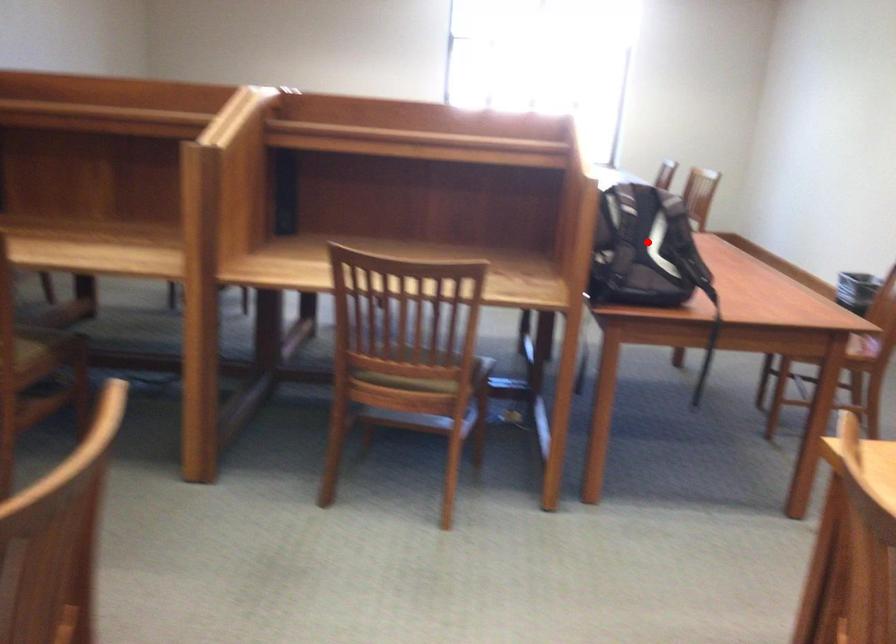
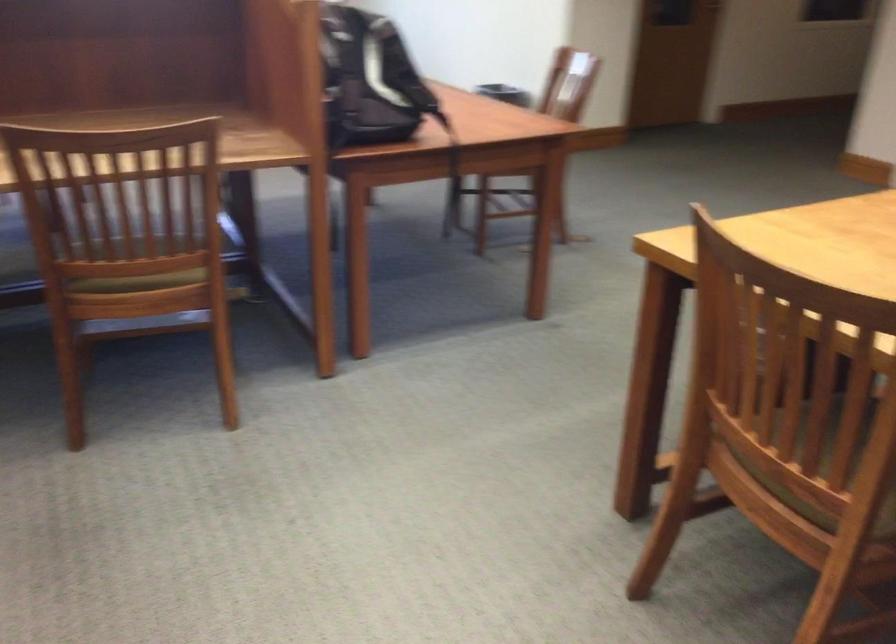
Locate, in the second image, the point that corresponds to the highlighted location in the first image.

(371, 80)